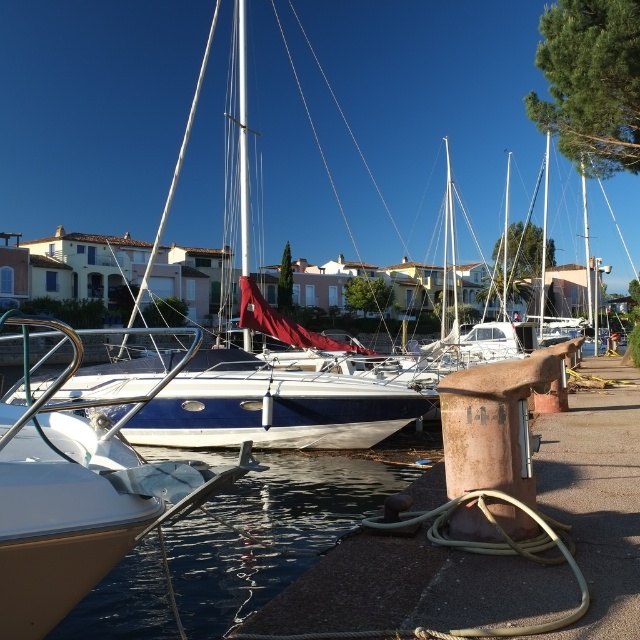
You are standing on the dock and want to take a photo of the white glossy sailboat at center without the clear water at lower left in the foreground. Is this possible given their positions?

The white glossy sailboat at center is behind the clear water at lower left, so it would be difficult to take a photo of the white glossy sailboat at center without the clear water at lower left in the foreground as it is positioned in front.